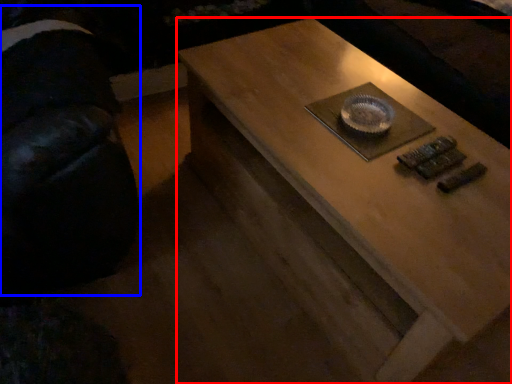
Question: Which object is closer to the camera taking this photo, coffee table (highlighted by a red box) or swivel chair (highlighted by a blue box)?

Choices:
 (A) coffee table
 (B) swivel chair

Answer: (B)